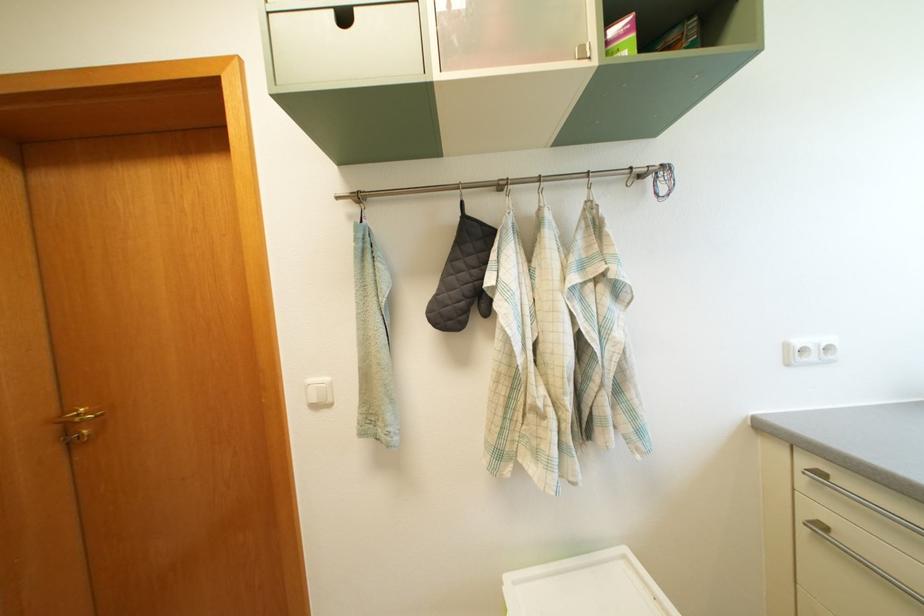
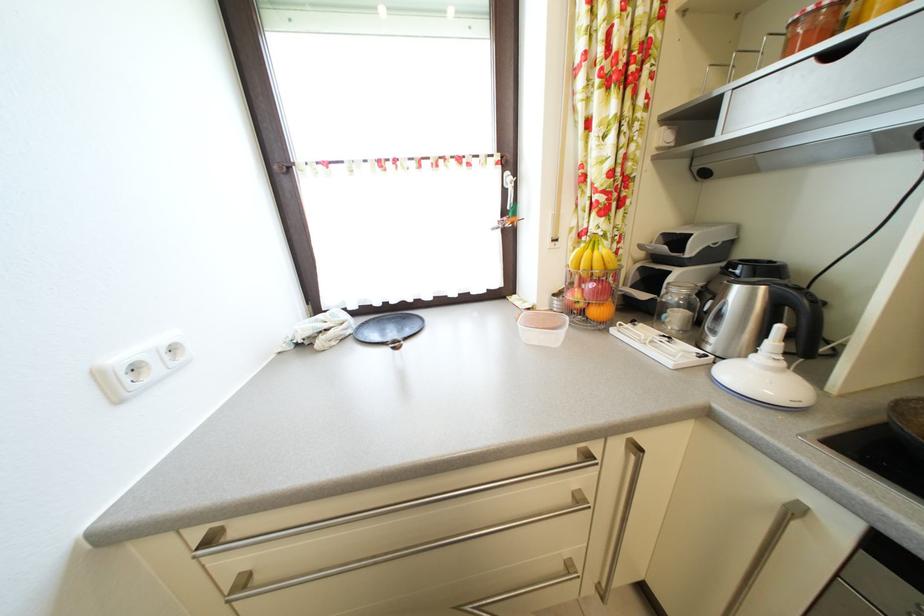
How did the camera likely rotate?

The camera's rotation is toward right-down.